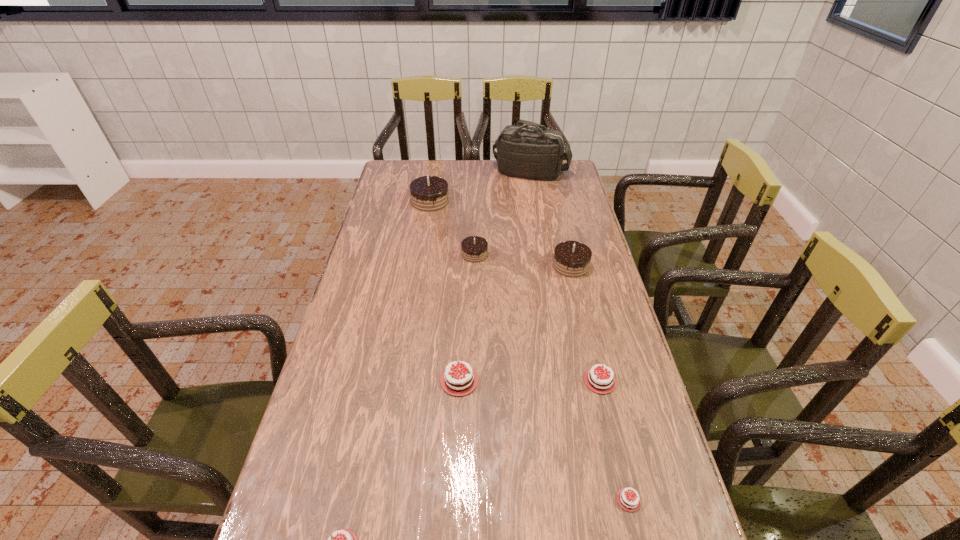
Locate an element on the screen. vacant area that lies between the shoulder bag and the third tallest object is located at coordinates (551, 219).

Find the location of a particular element. This screenshot has height=540, width=960. free space between the third red chocolate cake from right to left and the shortest chocolate cake is located at coordinates (544, 440).

Identify the location of vacant area that lies between the fifth tallest chocolate cake and the tallest object. (565, 276).

Locate an element on the screen. The image size is (960, 540). free space between the tallest object and the second red chocolate cake from left to right is located at coordinates (495, 276).

Where is `free space between the fourth shortest object and the tallest object`? This screenshot has width=960, height=540. free space between the fourth shortest object and the tallest object is located at coordinates (495, 276).

Identify which object is located as the third nearest to the third biggest red chocolate cake. Please provide its 2D coordinates. Your answer should be formatted as a tuple, i.e. [(x, y)], where the tuple contains the x and y coordinates of a point satisfying the conditions above.

[(602, 382)]

Locate which object ranks in proximity to the second smallest chocolate chocolate cake. Please provide its 2D coordinates. Your answer should be formatted as a tuple, i.e. [(x, y)], where the tuple contains the x and y coordinates of a point satisfying the conditions above.

[(474, 248)]

In order to click on chocolate cake that is the nearest to the farthest chocolate chocolate cake in this screenshot , I will do `click(474, 248)`.

You are a GUI agent. You are given a task and a screenshot of the screen. Output one action in this format:
    pyautogui.click(x=<x>, y=<y>)
    Task: Click on the second closest chocolate cake to the third red chocolate cake from right to left
    
    Given the screenshot: What is the action you would take?
    pyautogui.click(x=339, y=539)

Select which chocolate chocolate cake appears as the closest to the sixth tallest object. Please provide its 2D coordinates. Your answer should be formatted as a tuple, i.e. [(x, y)], where the tuple contains the x and y coordinates of a point satisfying the conditions above.

[(571, 258)]